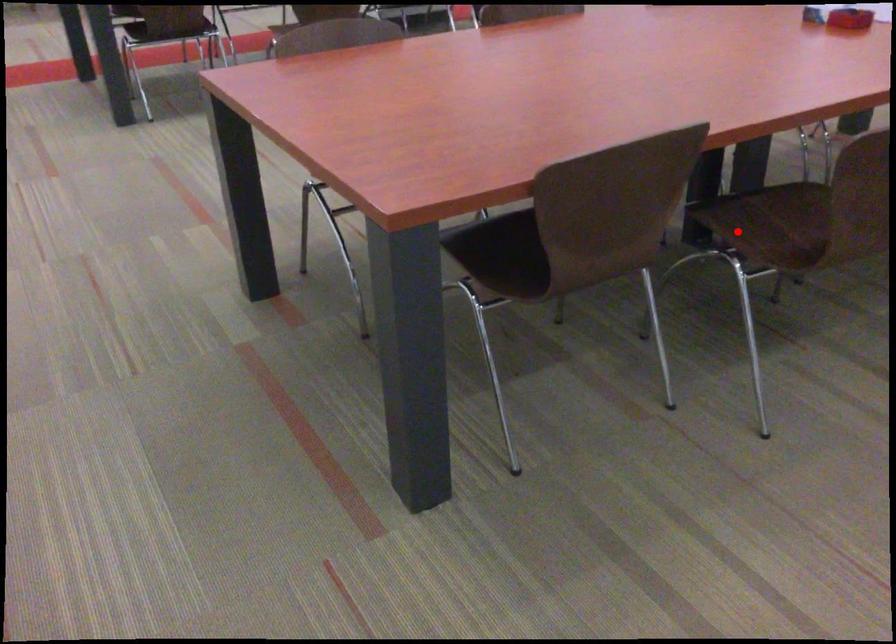
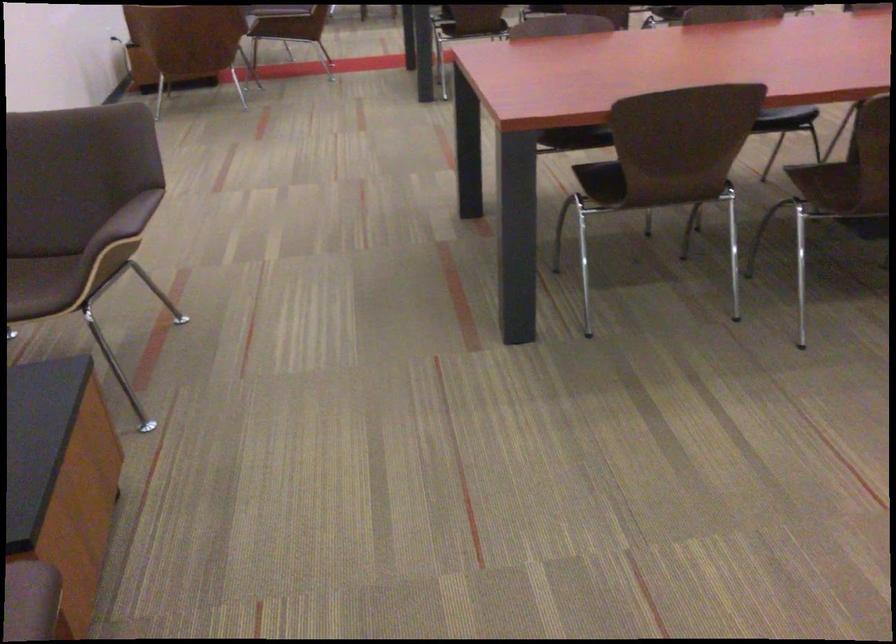
Question: I am providing you with two images of the same scene from different viewpoints. Given a red point in image1, look at the same physical point in image2. Is it:

Choices:
 (A) Closer to the viewpoint
 (B) Farther from the viewpoint

Answer: (B)